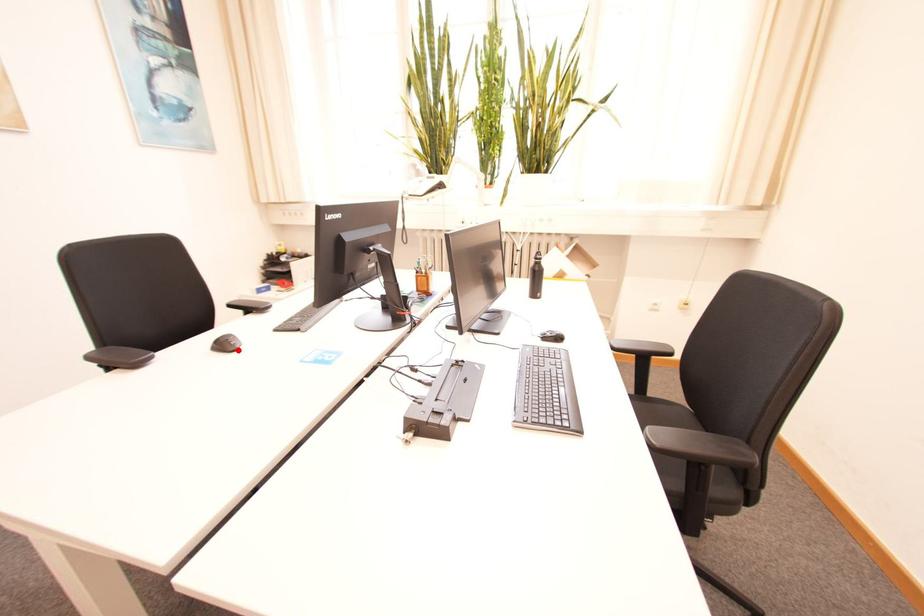
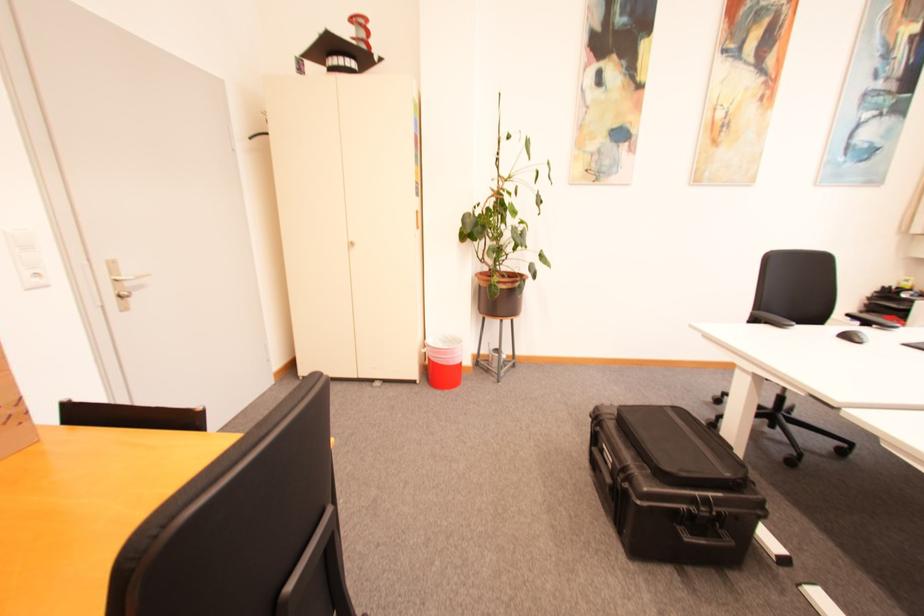
Where in the second image is the point corresponding to the highlighted location from the first image?

(865, 342)